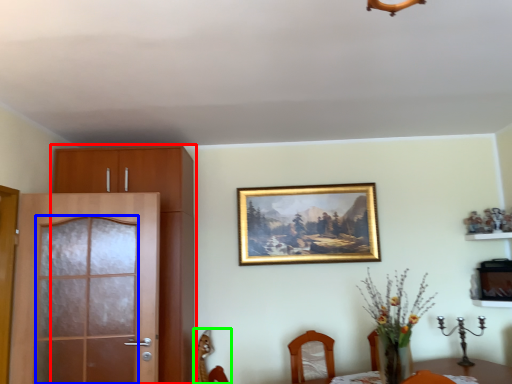
Question: Which object is the farthest from cabinetry (highlighted by a red box)? Choose among these: screen door (highlighted by a blue box) or chair (highlighted by a green box).

Choices:
 (A) screen door
 (B) chair

Answer: (B)